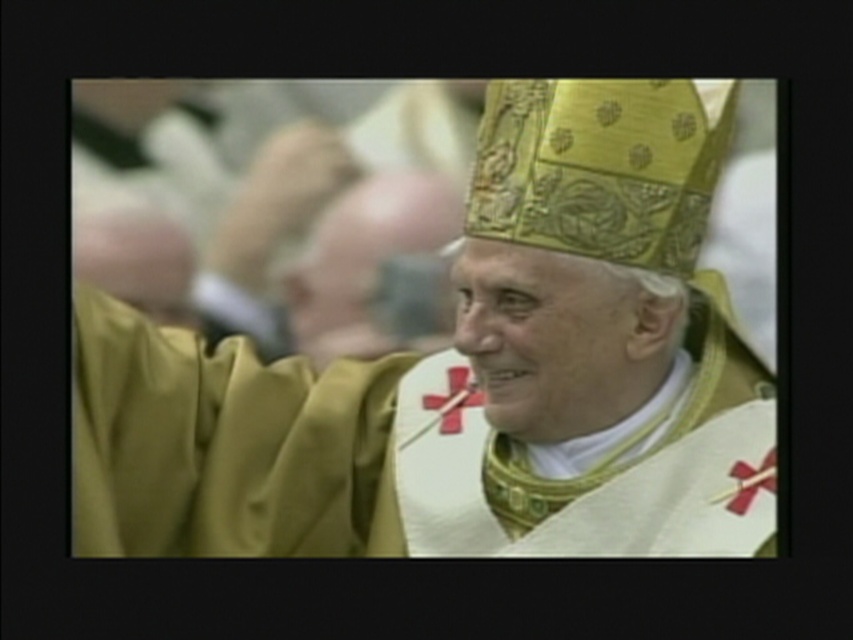
Can you confirm if gold textured mitre at center is bigger than red matte cross at center?

Correct, gold textured mitre at center is larger in size than red matte cross at center.

Is point (488, 422) farther from viewer compared to point (424, 401)?

No, it is in front of (424, 401).

Locate an element on the screen. This screenshot has height=640, width=853. gold textured mitre at center is located at coordinates (471, 376).

Who is more forward, [450,204] or [426,403]?

Point [426,403] is in front.

Does gold textured robe at center have a smaller size compared to red matte cross at center?

No.

Does point (331, 296) come closer to viewer compared to point (469, 392)?

No, it is behind (469, 392).

Locate an element on the screen. gold textured robe at center is located at coordinates (329, 234).

Is gold textured mitre at center positioned before gold textured robe at center?

Yes, it is.

Does gold textured mitre at center appear on the right side of gold textured robe at center?

Correct, you'll find gold textured mitre at center to the right of gold textured robe at center.

Where is `gold textured mitre at center`? gold textured mitre at center is located at coordinates point(471,376).

Image resolution: width=853 pixels, height=640 pixels. Find the location of `gold textured mitre at center`. gold textured mitre at center is located at coordinates (471, 376).